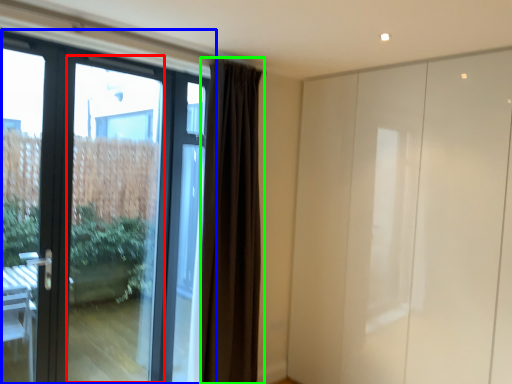
Question: Which is farther away from glass door (highlighted by a red box)? door (highlighted by a blue box) or curtain (highlighted by a green box)?

Choices:
 (A) door
 (B) curtain

Answer: (B)